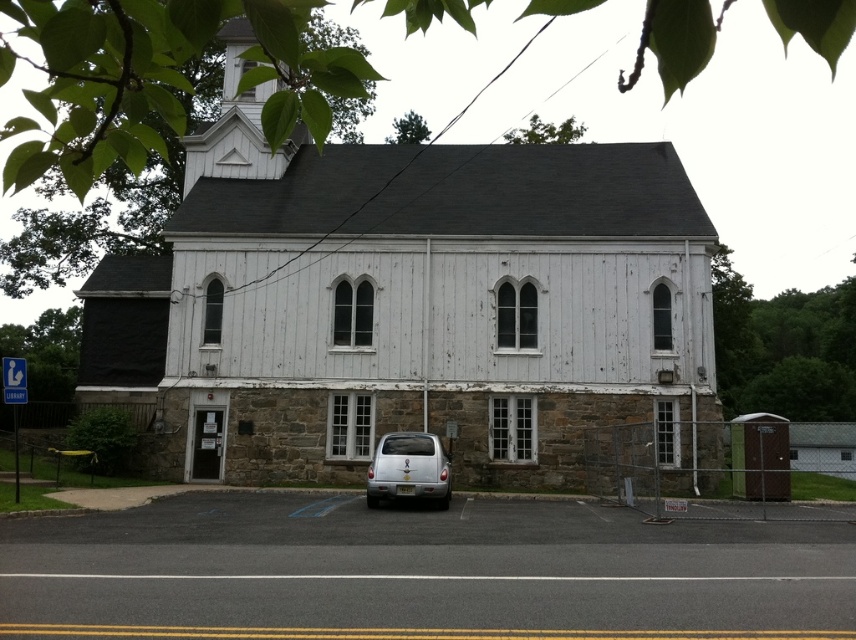
Question: Observing the image, what is the correct spatial positioning of white wood chapel at center in reference to silver metallic car at center?

Choices:
 (A) below
 (B) above

Answer: (B)

Question: Does white wood chapel at center have a greater width compared to silver metallic car at center?

Choices:
 (A) yes
 (B) no

Answer: (A)

Question: Which point appears closest to the camera in this image?

Choices:
 (A) (562, 481)
 (B) (403, 433)

Answer: (B)

Question: Which point is closer to the camera taking this photo?

Choices:
 (A) (299, 360)
 (B) (390, 451)

Answer: (B)

Question: Can you confirm if white wood chapel at center is positioned to the left of silver metallic car at center?

Choices:
 (A) yes
 (B) no

Answer: (A)